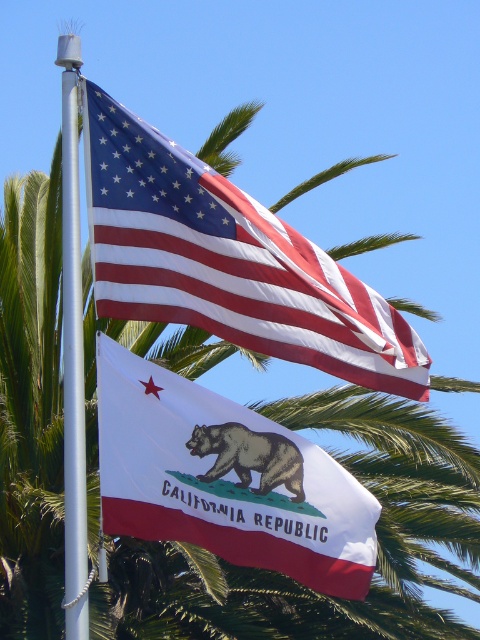
Is matte cotton flag at upper center to the right of white fabric flag at center from the viewer's perspective?

Yes, matte cotton flag at upper center is to the right of white fabric flag at center.

Which is in front, point (192, 252) or point (199, 396)?

Point (199, 396) is more forward.

Where is `matte cotton flag at upper center`? matte cotton flag at upper center is located at coordinates (227, 260).

Does point (101, 305) lie in front of point (78, 579)?

No.

Which of these two, matte cotton flag at upper center or white metallic pole at left, stands taller?

white metallic pole at left

You are a GUI agent. You are given a task and a screenshot of the screen. Output one action in this format:
    pyautogui.click(x=<x>, y=<y>)
    Task: Click on the matte cotton flag at upper center
    This screenshot has width=480, height=640.
    Given the screenshot: What is the action you would take?
    pyautogui.click(x=227, y=260)

You are a GUI agent. You are given a task and a screenshot of the screen. Output one action in this format:
    pyautogui.click(x=<x>, y=<y>)
    Task: Click on the matte cotton flag at upper center
    
    Given the screenshot: What is the action you would take?
    pyautogui.click(x=227, y=260)

Does white fabric flag at center have a greater width compared to white metallic pole at left?

No, white fabric flag at center is not wider than white metallic pole at left.

Between white fabric flag at center and white metallic pole at left, which one appears on the left side from the viewer's perspective?

From the viewer's perspective, white metallic pole at left appears more on the left side.

In the scene shown: Who is more distant from viewer, (180, 412) or (78, 196)?

The point (78, 196) is more distant.

Image resolution: width=480 pixels, height=640 pixels. Identify the location of white fabric flag at center. (226, 480).